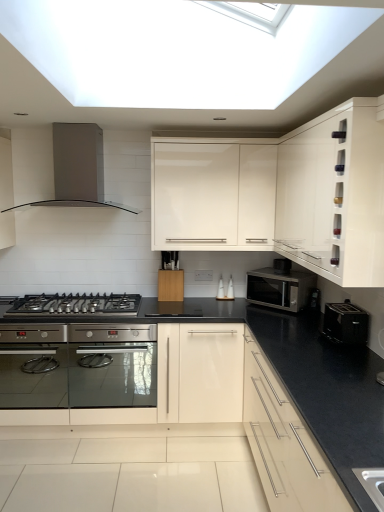
At what (x,y) coordinates should I click in order to perform the action: click on vacant area that is in front of black plastic toaster at right, which is the 2th appliance in left-to-right order. Please return your answer as a coordinate pair (x, y). The height and width of the screenshot is (512, 384). Looking at the image, I should click on (348, 352).